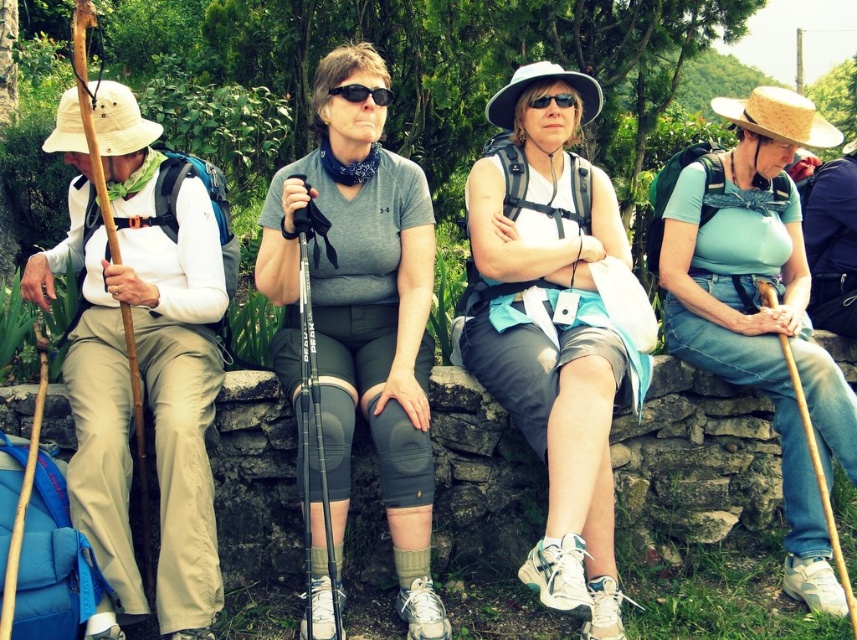
Consider the image. You are standing at point (370, 93) and want to move to point (406, 316). Is the destination point behind you?

Yes, the destination point (406, 316) is behind you because it is located behind point (370, 93) where you are standing.

You are part of a hiking group and need to hand over a map to the person with the black matte sunglasses at center. The map must be passed through the gray matte knee pads at center. Is this possible given their positions?

The gray matte knee pads at center is to the left of the black matte sunglasses at center, so passing the map through the knee pads would allow it to reach the sunglasses wearer.

You are a photographer trying to capture the perfect shot of the gray matte knee pads at center. Given their position at coordinates 0.492 on the x and 0.425 on the y axis, where exactly should you aim your camera to ensure the knee pads are centered in the frame?

To center the gray matte knee pads at center in the frame, aim your camera precisely at the coordinates 0.492 on the x axis and 0.425 on the y axis, as this is their exact 2D location in the image.